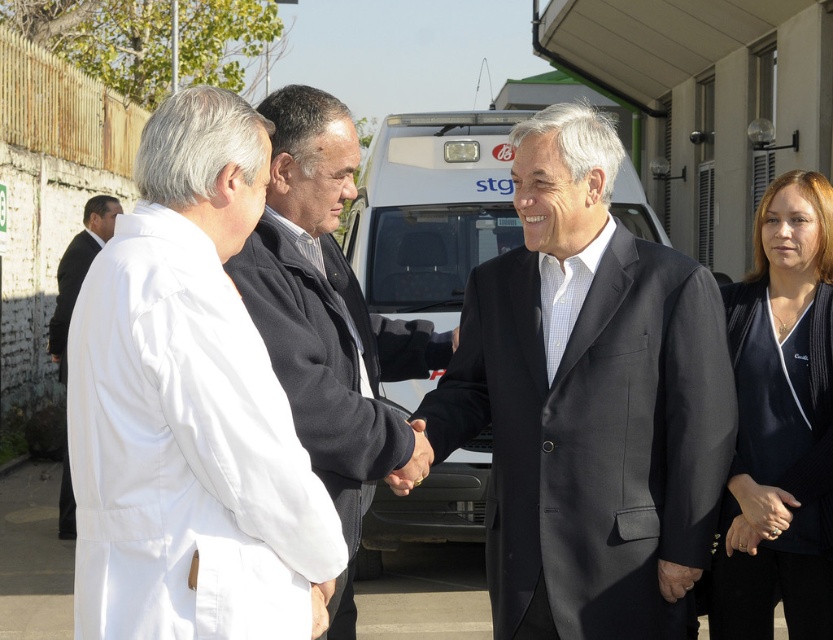
Can you confirm if matte black suit at center is thinner than dark gray sweater at center?

Incorrect, matte black suit at center's width is not less than dark gray sweater at center's.

Locate an element on the screen. matte black suit at center is located at coordinates (587, 401).

Measure the distance between point (667,282) and camera.

3.97 meters

You are a GUI agent. You are given a task and a screenshot of the screen. Output one action in this format:
    pyautogui.click(x=<x>, y=<y>)
    Task: Click on the matte black suit at center
    This screenshot has height=640, width=833.
    Given the screenshot: What is the action you would take?
    pyautogui.click(x=587, y=401)

Who is higher up, dark gray sweater at center or white coat at left?

Positioned higher is white coat at left.

From the picture: Does dark gray sweater at center have a smaller size compared to white coat at left?

No.

Is point (348, 433) closer to camera compared to point (60, 525)?

Yes, point (348, 433) is in front of point (60, 525).

Locate an element on the screen. Image resolution: width=833 pixels, height=640 pixels. dark gray sweater at center is located at coordinates (327, 312).

Does matte black suit at center have a larger size compared to white coat at left?

Actually, matte black suit at center might be smaller than white coat at left.

Does point (491, 288) come behind point (85, 211)?

No, (491, 288) is in front of (85, 211).

Is point (552, 548) less distant than point (63, 349)?

Yes, point (552, 548) is closer to viewer.

Locate an element on the screen. This screenshot has height=640, width=833. matte black suit at center is located at coordinates (587, 401).